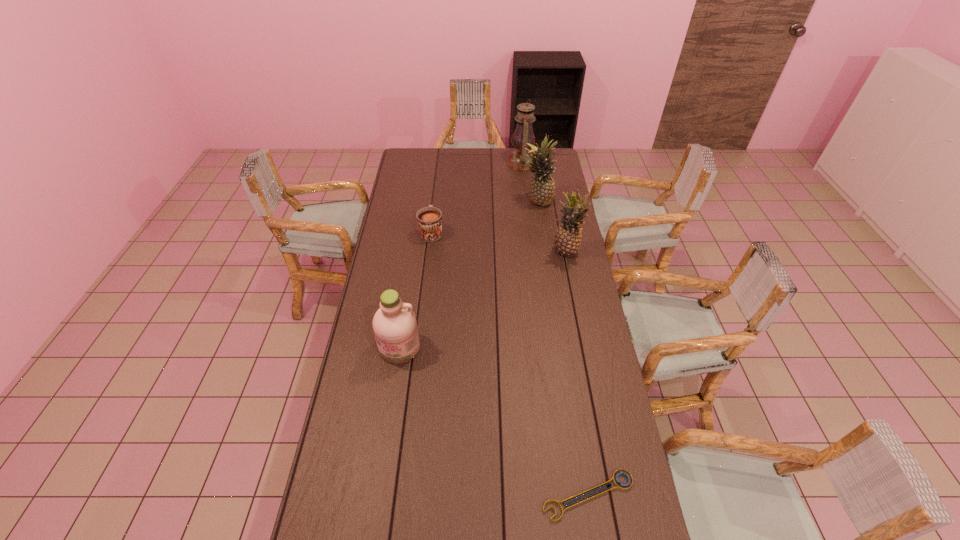
I want to click on oil lamp, so click(x=518, y=160).

Locate an element on the screen. the farther pineapple is located at coordinates (542, 187).

Locate an element on the screen. This screenshot has height=540, width=960. the nearer pineapple is located at coordinates (567, 241).

The image size is (960, 540). Identify the location of the fifth farthest object. [x=395, y=327].

This screenshot has width=960, height=540. Identify the location of the second shortest object. (429, 219).

Where is `the nearest object`? This screenshot has height=540, width=960. the nearest object is located at coordinates click(623, 472).

Locate an element on the screen. This screenshot has width=960, height=540. the shortest object is located at coordinates (623, 472).

The width and height of the screenshot is (960, 540). Find the location of `vacant area located on the right of the farthest object`. vacant area located on the right of the farthest object is located at coordinates (549, 163).

At what (x,y) coordinates should I click in order to perform the action: click on vacant space positioned 0.060m on the right of the fifth nearest object. Please return your answer as a coordinate pair (x, y). This screenshot has height=540, width=960. Looking at the image, I should click on (565, 202).

I want to click on vacant space situated 0.190m on the left of the nearer pineapple, so click(x=509, y=253).